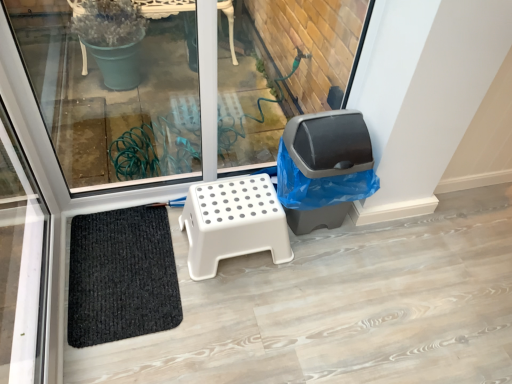
Question: Looking at the image, does white plastic stool at center seem bigger or smaller compared to gray plastic trash can at center right?

Choices:
 (A) small
 (B) big

Answer: (A)

Question: Considering the positions of point (280, 248) and point (318, 134), is point (280, 248) closer or farther from the camera than point (318, 134)?

Choices:
 (A) farther
 (B) closer

Answer: (A)

Question: Estimate the real-world distances between objects in this image. Which object is farther from the gray plastic trash can at center right?

Choices:
 (A) white plastic stool at center
 (B) transparent glass window at center
 (C) black woven mat at lower left

Answer: (B)

Question: Which object is positioned closest to the transparent glass window at center?

Choices:
 (A) gray plastic trash can at center right
 (B) white plastic stool at center
 (C) black woven mat at lower left

Answer: (C)